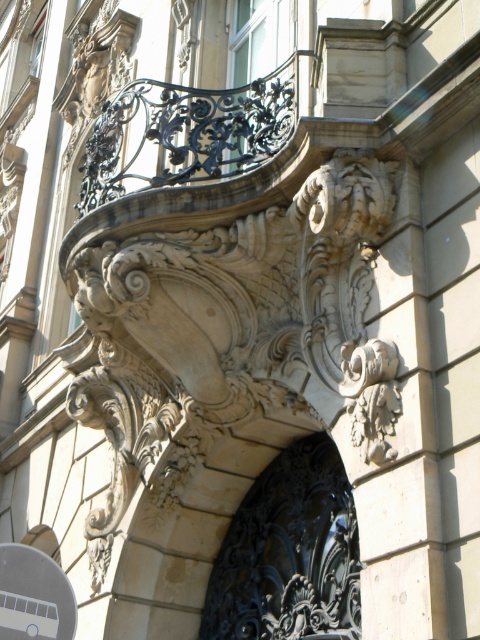
Which is below, white plastic bus at lower left or white stone carving at center?

white plastic bus at lower left is below.

Looking at this image, is white plastic bus at lower left thinner than white stone carving at center?

No.

Is point (27, 556) more distant than point (397, 392)?

Yes, it is behind point (397, 392).

The image size is (480, 640). I want to click on white plastic bus at lower left, so click(34, 595).

Does black wrought iron door at center come behind white plastic bus at lower left?

Yes, black wrought iron door at center is behind white plastic bus at lower left.

Is black wrought iron door at center below white plastic bus at lower left?

Incorrect, black wrought iron door at center is not positioned below white plastic bus at lower left.

The height and width of the screenshot is (640, 480). Describe the element at coordinates (289, 554) in the screenshot. I see `black wrought iron door at center` at that location.

Identify the location of black wrought iron door at center. (289, 554).

Is point (229, 628) less distant than point (385, 397)?

No.

Is black wrought iron door at center bigger than white stone carving at center?

Actually, black wrought iron door at center might be smaller than white stone carving at center.

Based on the photo, measure the distance between black wrought iron door at center and camera.

They are 87.54 feet apart.

Identify the location of black wrought iron door at center. (289, 554).